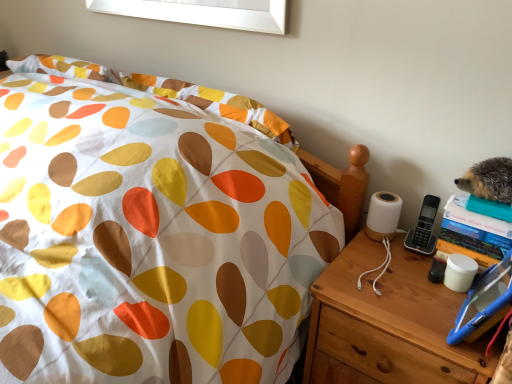
Question: Is wooden nightstand at right bigger or smaller than white fabric bed at center?

Choices:
 (A) big
 (B) small

Answer: (B)

Question: In terms of height, does wooden nightstand at right look taller or shorter compared to white fabric bed at center?

Choices:
 (A) tall
 (B) short

Answer: (A)

Question: Would you say wooden nightstand at right is to the left or to the right of white fabric bed at center in the picture?

Choices:
 (A) right
 (B) left

Answer: (A)

Question: Relative to wooden nightstand at right, is white fabric bed at center in front or behind?

Choices:
 (A) front
 (B) behind

Answer: (A)

Question: Considering the positions of white fabric bed at center and wooden nightstand at right in the image, is white fabric bed at center taller or shorter than wooden nightstand at right?

Choices:
 (A) short
 (B) tall

Answer: (A)

Question: Based on their sizes in the image, would you say white fabric bed at center is bigger or smaller than wooden nightstand at right?

Choices:
 (A) big
 (B) small

Answer: (A)

Question: Visually, is white fabric bed at center positioned to the left or to the right of wooden nightstand at right?

Choices:
 (A) left
 (B) right

Answer: (A)